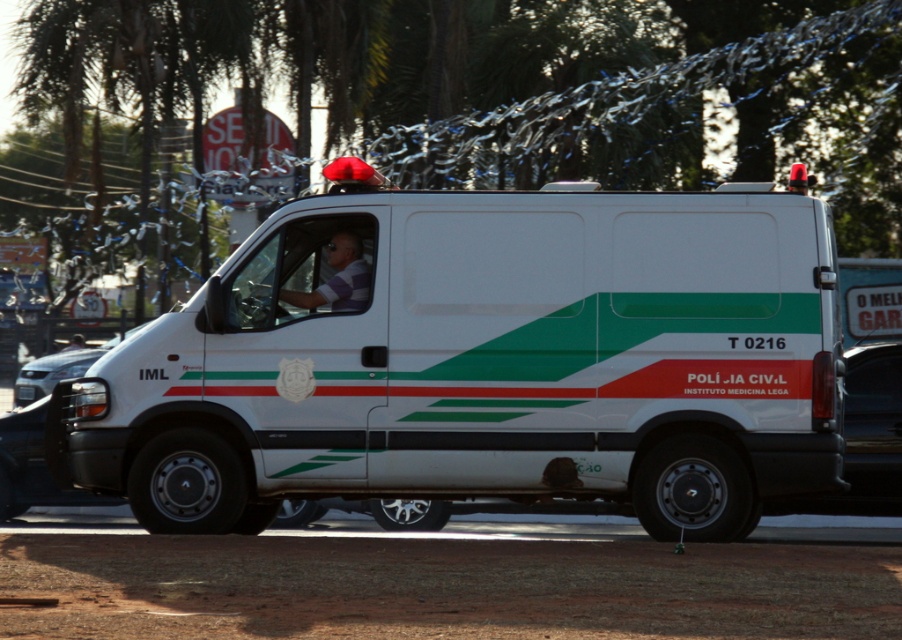
You are an observer standing in front of the van. You notice the white striped shirt at center and the matte white headlight at left. Which object takes up more space in the image?

The matte white headlight at left takes up more space in the image than the white striped shirt at center because the white striped shirt at center occupies less space than matte white headlight at left.

You are a pedestrian standing in front of the van. You see the white striped shirt at center and the matte white headlight at left. Which object is closer to the left side of the van?

The matte white headlight at left is closer to the left side of the van because it is positioned to the left of the white striped shirt at center.